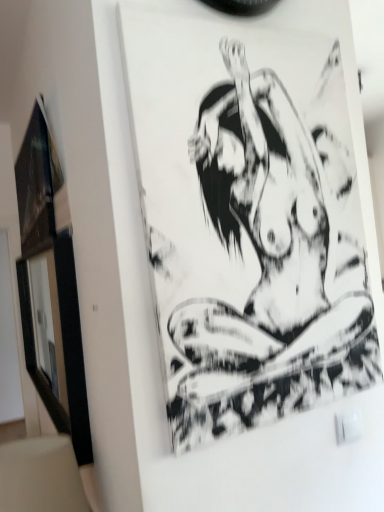
Question: Is black ink drawing at center bigger or smaller than matte black picture frame at left?

Choices:
 (A) big
 (B) small

Answer: (B)

Question: From a real-world perspective, is black ink drawing at center positioned above or below matte black picture frame at left?

Choices:
 (A) below
 (B) above

Answer: (A)

Question: Is black ink drawing at center situated inside matte black picture frame at left or outside?

Choices:
 (A) outside
 (B) inside

Answer: (A)

Question: Looking at their shapes, would you say matte black picture frame at left is wider or thinner than black ink drawing at center?

Choices:
 (A) thin
 (B) wide

Answer: (B)

Question: From a real-world perspective, is matte black picture frame at left physically located above or below black ink drawing at center?

Choices:
 (A) above
 (B) below

Answer: (A)

Question: Looking at the image, does matte black picture frame at left seem bigger or smaller compared to black ink drawing at center?

Choices:
 (A) small
 (B) big

Answer: (B)

Question: Is point (33, 203) closer or farther from the camera than point (175, 318)?

Choices:
 (A) farther
 (B) closer

Answer: (A)